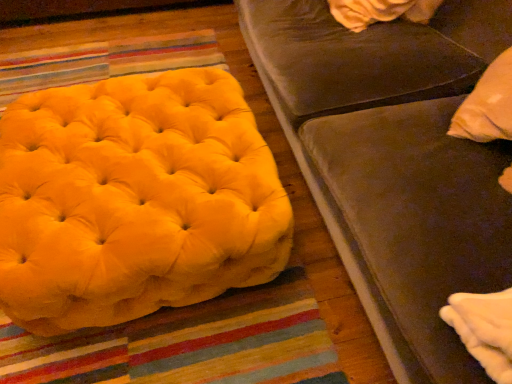
Question: From the image's perspective, is yellow velvet ottoman at left located above or below velvet brown studio couch at upper right?

Choices:
 (A) above
 (B) below

Answer: (B)

Question: Is yellow velvet ottoman at left taller or shorter than velvet brown studio couch at upper right?

Choices:
 (A) short
 (B) tall

Answer: (A)

Question: In the image, is yellow velvet ottoman at left on the left side or the right side of velvet brown studio couch at upper right?

Choices:
 (A) right
 (B) left

Answer: (B)

Question: From a real-world perspective, is velvet brown studio couch at upper right above or below yellow velvet ottoman at left?

Choices:
 (A) above
 (B) below

Answer: (A)

Question: In the image, is velvet brown studio couch at upper right on the left side or the right side of yellow velvet ottoman at left?

Choices:
 (A) left
 (B) right

Answer: (B)

Question: Is velvet brown studio couch at upper right spatially inside yellow velvet ottoman at left, or outside of it?

Choices:
 (A) outside
 (B) inside

Answer: (A)

Question: In the image, is velvet brown studio couch at upper right positioned in front of or behind yellow velvet ottoman at left?

Choices:
 (A) behind
 (B) front

Answer: (B)